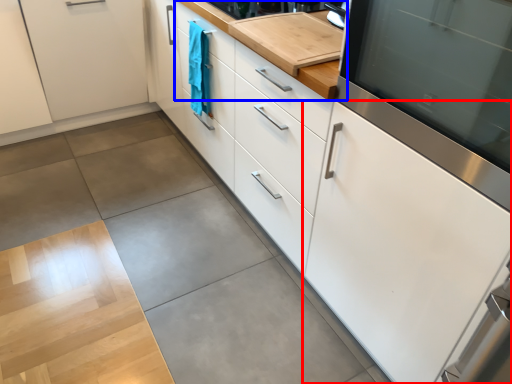
Question: Which of the following is the farthest to the observer, cabinetry (highlighted by a red box) or countertop (highlighted by a blue box)?

Choices:
 (A) cabinetry
 (B) countertop

Answer: (B)